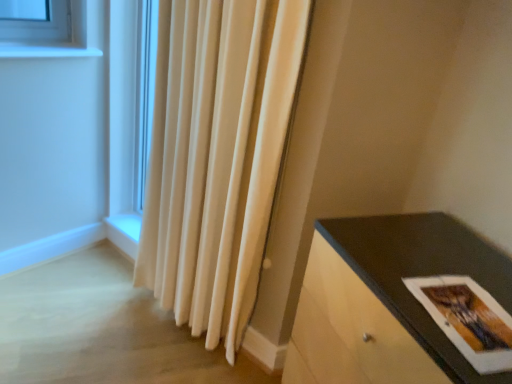
Find the location of a particular element. Image resolution: width=512 pixels, height=384 pixels. blank space situated above matte black table at lower right (from a real-world perspective) is located at coordinates pos(438,286).